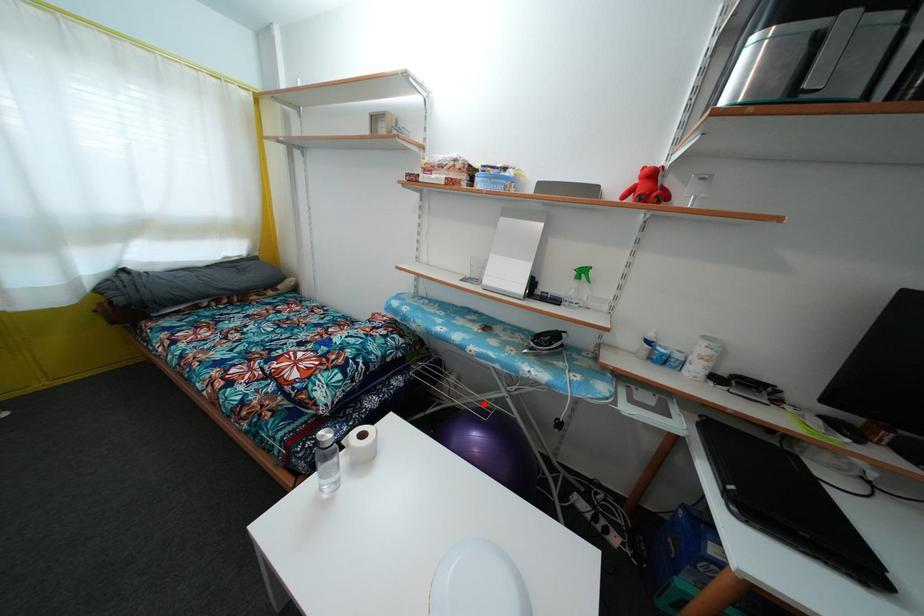
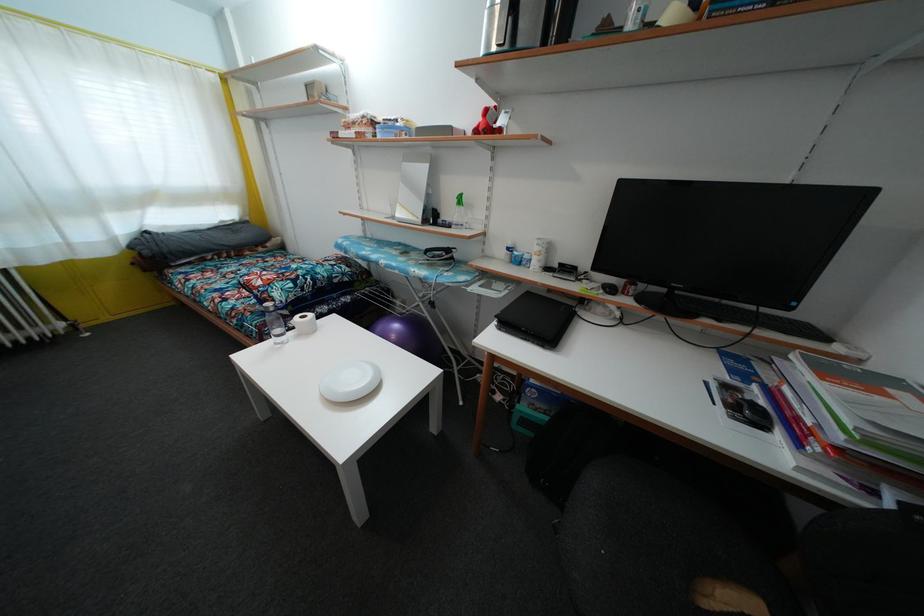
Question: I am providing you with two images of the same scene from different viewpoints. A red point is shown in image1. For the corresponding object point in image2, is it positioned nearer or farther from the camera?

Choices:
 (A) Nearer
 (B) Farther

Answer: (A)